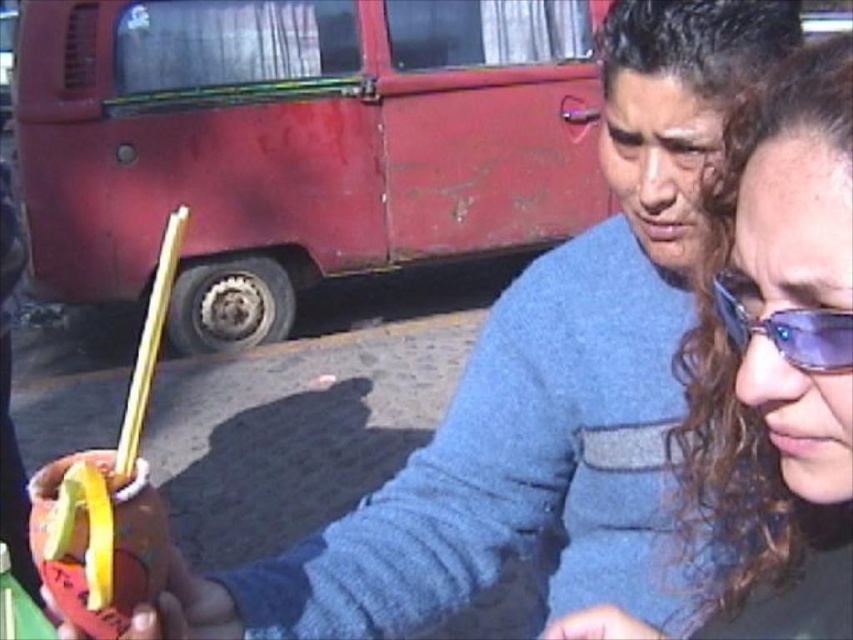
You are a photographer trying to capture a portrait of the matte brown hair at center and the shiny blue goggles at right. Since you want to ensure both subjects are in focus, you need to know their heights relative to each other. Which object is taller?

The matte brown hair at center is taller than the shiny blue goggles at right.

From the picture: You are a photographer trying to capture a closeup of the shiny blue goggles at right and the matte brown hair at center. Which object should you focus on first to ensure both are in frame?

The matte brown hair at center is positioned on the right side of shiny blue goggles at right, so you should focus on the shiny blue goggles at right first to ensure both are in frame.

You are a photographer trying to capture a closeup of the matte brown hair at center and the shiny blue goggles at right. Which object do you need to adjust your camera lens to focus on first if you want to ensure both are in focus, considering their sizes?

The matte brown hair at center is wider than the shiny blue goggles at right. To ensure both are in focus, adjust the camera lens to focus on the wider matte brown hair at center first.